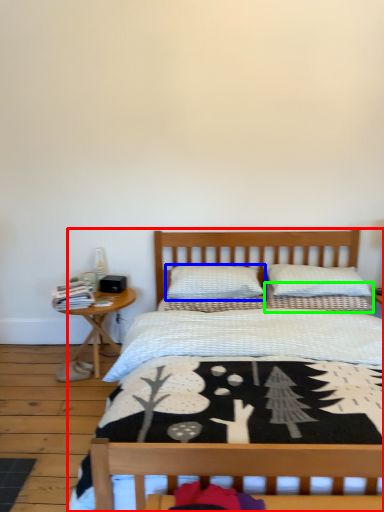
Question: Estimate the real-world distances between objects in this image. Which object is farther from bed (highlighted by a red box), pillow (highlighted by a blue box) or pillow (highlighted by a green box)?

Choices:
 (A) pillow
 (B) pillow

Answer: (A)